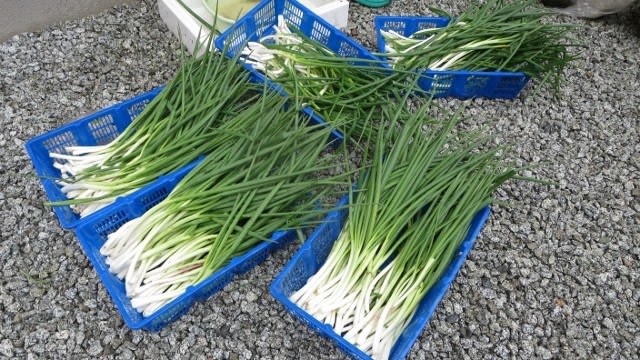
At what (x,y) coordinates should I click in order to perform the action: click on plastic bin. Please return your answer as a coordinate pair (x, y). The width and height of the screenshot is (640, 360). Looking at the image, I should click on [x=54, y=141], [x=107, y=220], [x=294, y=280], [x=299, y=17], [x=394, y=28].